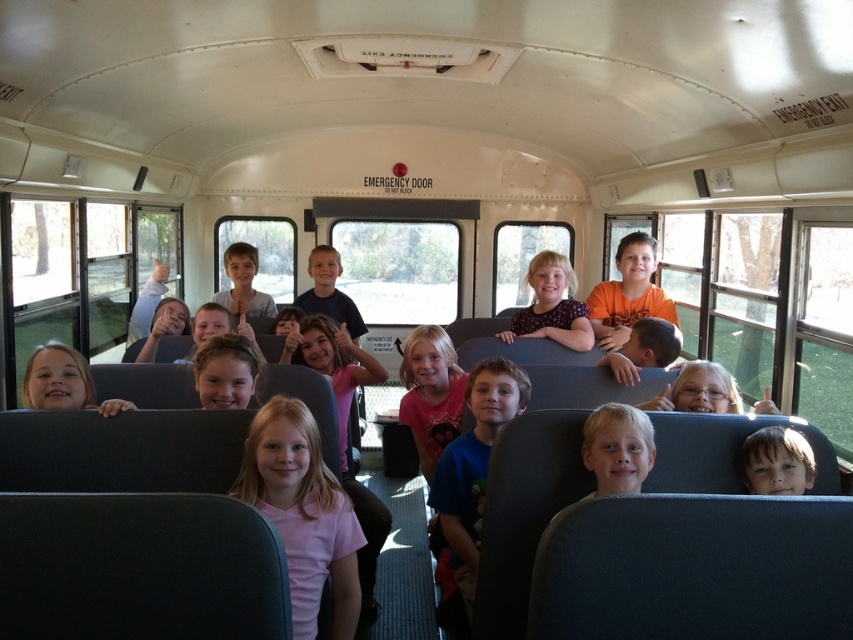
Question: Which point is farther to the camera?

Choices:
 (A) light blonde hair at center
 (B) blue cotton shirt at center
 (C) matte white shirt at center
 (D) orange t-shirt at center

Answer: (C)

Question: Which point is farther to the camera?

Choices:
 (A) orange t-shirt at center
 (B) matte white shirt at center
 (C) pink matte shirt at lower center
 (D) blue cotton shirt at center

Answer: (B)

Question: Is orange t-shirt at center positioned before matte white shirt at center?

Choices:
 (A) yes
 (B) no

Answer: (A)

Question: In this image, where is blue cotton shirt at center located relative to light blonde hair at center?

Choices:
 (A) right
 (B) left

Answer: (B)

Question: Can you confirm if light blonde hair at center is smaller than purple dotted dress at center?

Choices:
 (A) no
 (B) yes

Answer: (B)

Question: Which object is the farthest from the blue cotton shirt at center?

Choices:
 (A) purple dotted dress at center
 (B) smooth blonde hair at lower right
 (C) light blonde hair at center
 (D) orange t-shirt at center

Answer: (D)